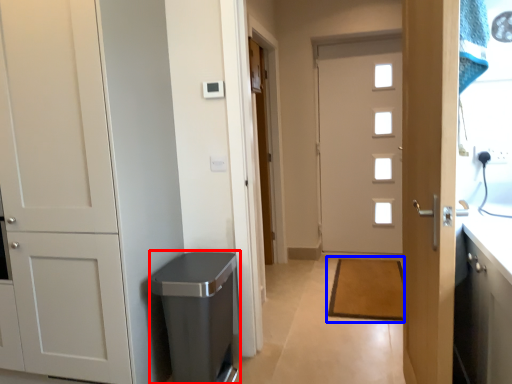
Question: Which object appears closest to the camera in this image, dish washer (highlighted by a red box) or doormat (highlighted by a blue box)?

Choices:
 (A) dish washer
 (B) doormat

Answer: (A)